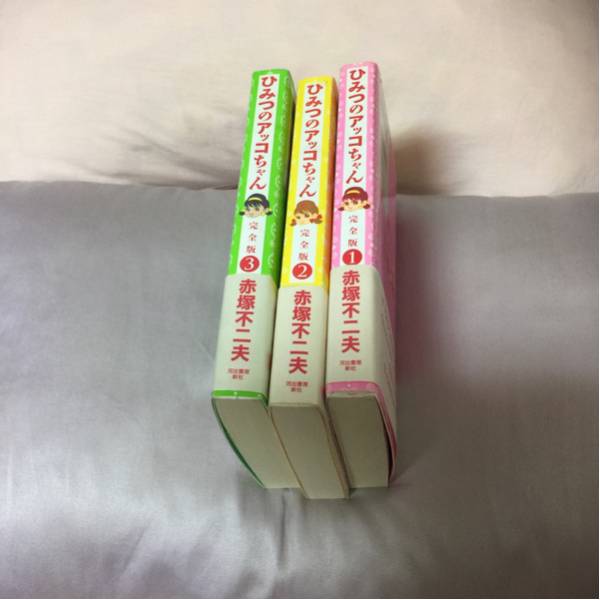
The height and width of the screenshot is (600, 600). Find the location of `gap between book cover and book pages`. gap between book cover and book pages is located at coordinates (391, 449).